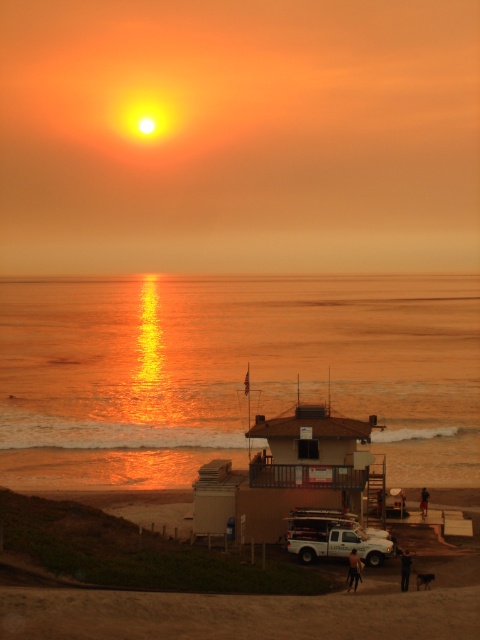
Question: Among these points, which one is farthest from the camera?

Choices:
 (A) (52, 618)
 (B) (72, 429)
 (C) (320, 547)

Answer: (B)

Question: Which object appears closest to the camera in this image?

Choices:
 (A) black leather pants at lower center
 (B) golden reflective water at center

Answer: (A)

Question: Is white matte truck at center closer to the viewer compared to dark brown leather jacket at lower right?

Choices:
 (A) no
 (B) yes

Answer: (A)

Question: Is golden reflective water at center to the left of brown leather pants at lower center from the viewer's perspective?

Choices:
 (A) yes
 (B) no

Answer: (A)

Question: Is the position of golden reflective water at center less distant than that of brown leather pants at lower center?

Choices:
 (A) yes
 (B) no

Answer: (A)

Question: Which object is positioned closest to the white matte truck at center?

Choices:
 (A) black leather pants at lower center
 (B) brown leather pants at lower center

Answer: (A)